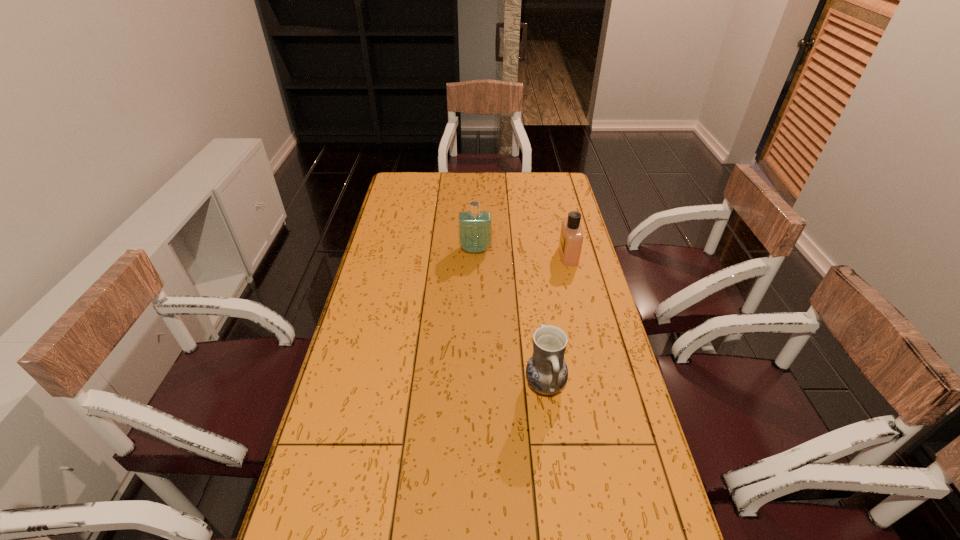
This screenshot has width=960, height=540. Identify the location of the left perfume. pos(474,227).

Where is `the nearest object`? the nearest object is located at coordinates pyautogui.click(x=546, y=371).

Where is `pottery`? pottery is located at coordinates (546, 371).

Identify the location of the rightmost object. This screenshot has width=960, height=540. pyautogui.click(x=571, y=237).

Where is `vacant position located on the front label of the leftmost object`? vacant position located on the front label of the leftmost object is located at coordinates (475, 286).

I want to click on free spot located on the front of the second object from right to left, so click(552, 441).

Locate an element on the screen. free space located on the front label of the right perfume is located at coordinates (475, 255).

In order to click on blank space located on the front label of the right perfume in this screenshot , I will do `click(470, 255)`.

Identify the location of free space located on the front label of the right perfume. (544, 255).

Locate an element on the screen. Image resolution: width=960 pixels, height=540 pixels. object located at the right edge is located at coordinates (571, 237).